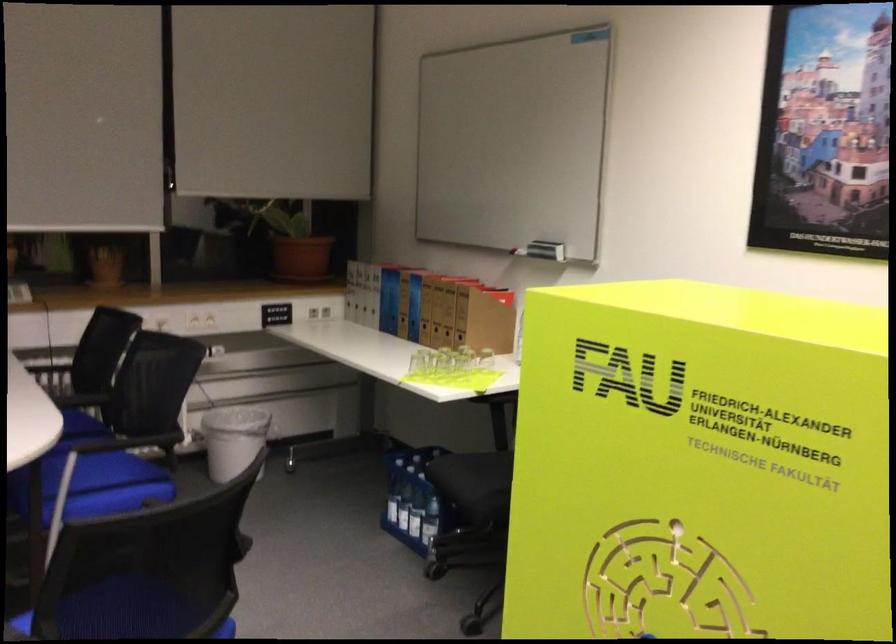
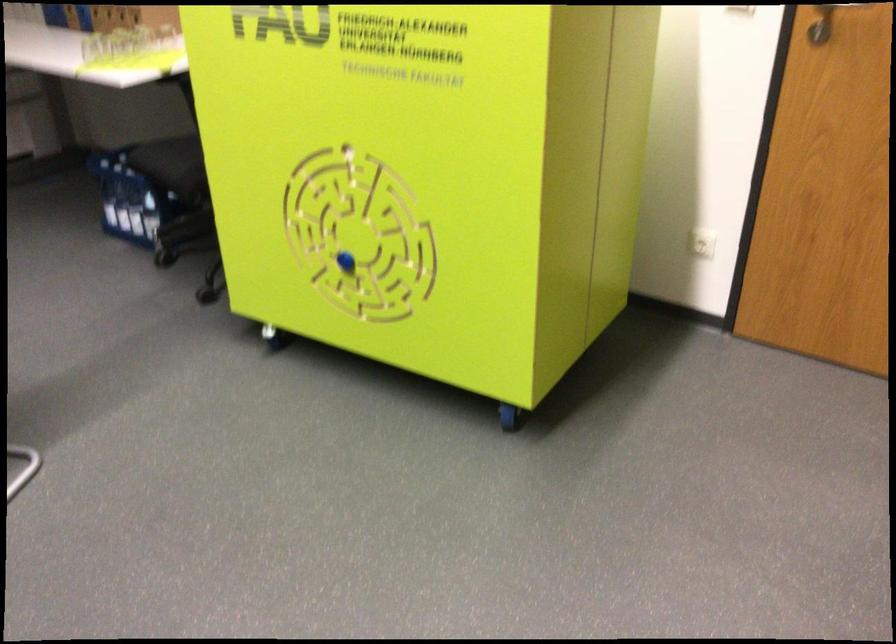
The point at (432, 493) is marked in the first image. Where is the corresponding point in the second image?

(149, 185)